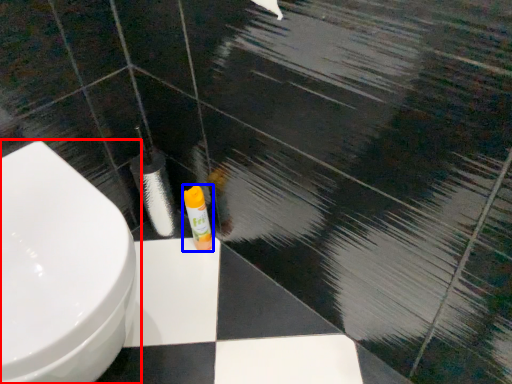
Question: Among these objects, which one is nearest to the camera, toilet (highlighted by a red box) or toiletry (highlighted by a blue box)?

Choices:
 (A) toilet
 (B) toiletry

Answer: (A)